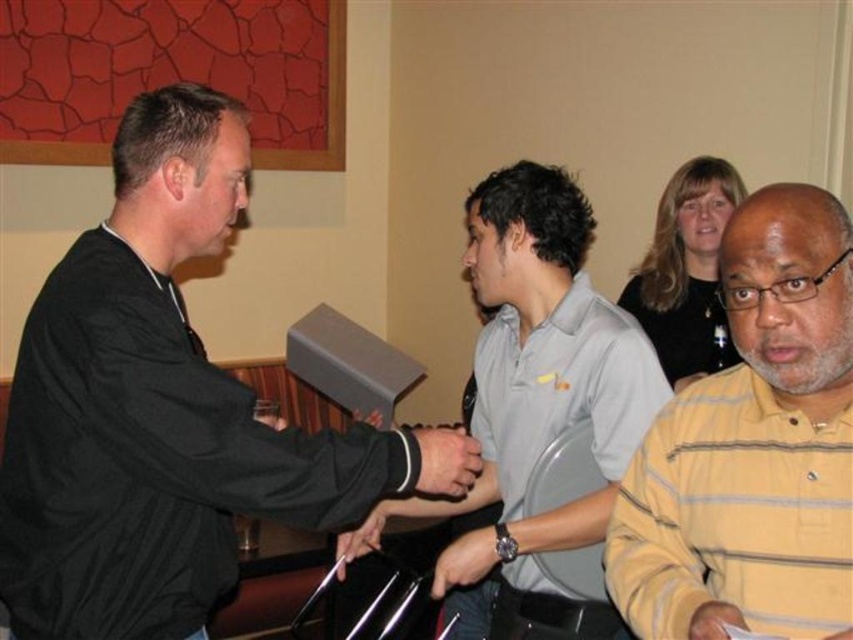
Question: Is black matte jacket at left in front of yellow striped shirt at right?

Choices:
 (A) no
 (B) yes

Answer: (A)

Question: Which point is closer to the camera?

Choices:
 (A) (788, 362)
 (B) (630, 333)
 (C) (213, 458)
 (D) (460, 488)

Answer: (A)

Question: Where is yellow striped shirt at right located in relation to gray matte shirt at center in the image?

Choices:
 (A) right
 (B) left

Answer: (A)

Question: Among these objects, which one is nearest to the camera?

Choices:
 (A) black matte jacket at left
 (B) matte black hand at center

Answer: (A)

Question: Which object is positioned farthest from the matte black hand at center?

Choices:
 (A) black matte jacket at left
 (B) yellow striped shirt at right
 (C) gray matte shirt at center

Answer: (B)

Question: Is yellow striped shirt at right wider than matte black hand at center?

Choices:
 (A) no
 (B) yes

Answer: (B)